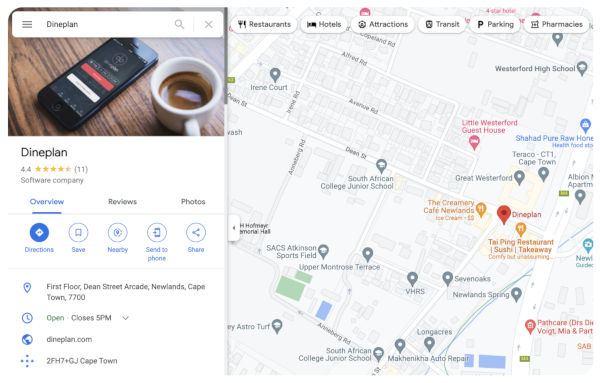
I want to click on coffee cup, so click(x=178, y=90).